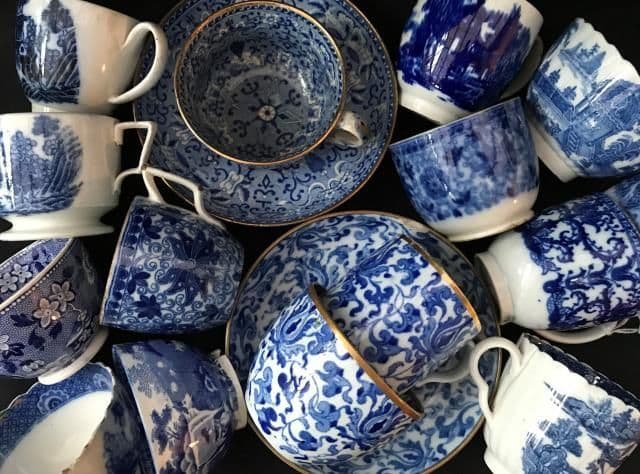
In order to click on coffee cups handles in this screenshot , I will do `click(161, 42)`, `click(152, 130)`, `click(150, 184)`, `click(444, 379)`, `click(509, 344)`, `click(589, 339)`, `click(345, 120)`, `click(538, 54)`.